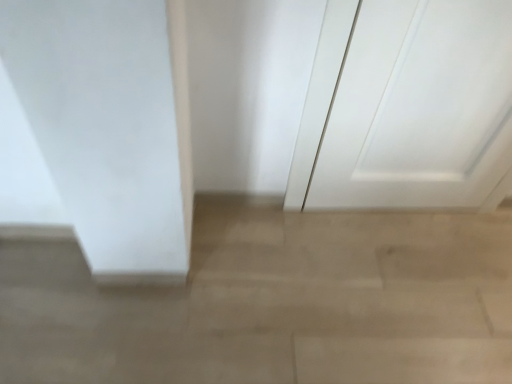
Locate an element on the screen. vacant space to the left of white matte door at upper right is located at coordinates (293, 241).